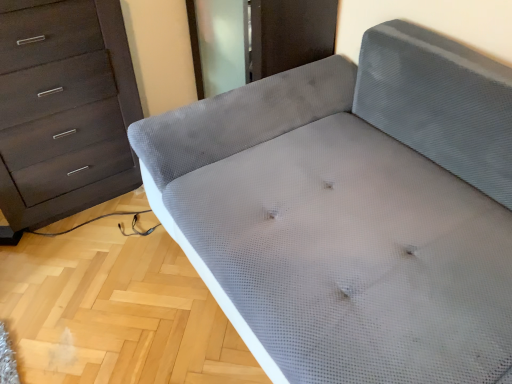
You are a GUI agent. You are given a task and a screenshot of the screen. Output one action in this format:
    pyautogui.click(x=<x>, y=<y>)
    Task: Click on the matte dark brown chest of drawers at left
    The image size is (512, 384).
    Given the screenshot: What is the action you would take?
    pyautogui.click(x=63, y=110)

The image size is (512, 384). What do you see at coordinates (63, 110) in the screenshot? I see `matte dark brown chest of drawers at left` at bounding box center [63, 110].

Measure the distance between point (109, 114) and camera.

5.44 feet.

Find the location of a particular element. The image size is (512, 384). gray fabric couch at center is located at coordinates (352, 211).

The image size is (512, 384). What do you see at coordinates (352, 211) in the screenshot? I see `gray fabric couch at center` at bounding box center [352, 211].

I want to click on matte dark brown chest of drawers at left, so click(x=63, y=110).

Is matte dark brown chest of drawers at left at the right side of gray fabric couch at center?

No.

Consider the image. Between matte dark brown chest of drawers at left and gray fabric couch at center, which one is positioned behind?

matte dark brown chest of drawers at left.

Does point (88, 13) appear closer or farther from the camera than point (408, 120)?

Point (88, 13) is closer to the camera than point (408, 120).

Based on the photo, from the image's perspective, relative to gray fabric couch at center, is matte dark brown chest of drawers at left above or below?

matte dark brown chest of drawers at left is above gray fabric couch at center.

From a real-world perspective, is matte dark brown chest of drawers at left under gray fabric couch at center?

No.

Is matte dark brown chest of drawers at left thinner than gray fabric couch at center?

Indeed, matte dark brown chest of drawers at left has a lesser width compared to gray fabric couch at center.

Can you confirm if matte dark brown chest of drawers at left is taller than gray fabric couch at center?

Indeed, matte dark brown chest of drawers at left has a greater height compared to gray fabric couch at center.

Based on their sizes in the image, would you say matte dark brown chest of drawers at left is bigger or smaller than gray fabric couch at center?

Considering their sizes, matte dark brown chest of drawers at left takes up less space than gray fabric couch at center.

Is matte dark brown chest of drawers at left inside or outside of gray fabric couch at center?

matte dark brown chest of drawers at left is not inside gray fabric couch at center, it's outside.

Is matte dark brown chest of drawers at left in contact with gray fabric couch at center?

There is a gap between matte dark brown chest of drawers at left and gray fabric couch at center.

Could you tell me if matte dark brown chest of drawers at left is facing gray fabric couch at center?

No, matte dark brown chest of drawers at left is not turned towards gray fabric couch at center.

How different are the orientations of matte dark brown chest of drawers at left and gray fabric couch at center in degrees?

90.8 degrees separate the facing orientations of matte dark brown chest of drawers at left and gray fabric couch at center.

The width and height of the screenshot is (512, 384). What are the coordinates of `the chest of drawers located above the gray fabric couch at center (from the image's perspective)` in the screenshot? It's located at (63, 110).

Based on the photo, considering the relative positions of gray fabric couch at center and matte dark brown chest of drawers at left in the image provided, is gray fabric couch at center to the right of matte dark brown chest of drawers at left from the viewer's perspective?

Yes, gray fabric couch at center is to the right of matte dark brown chest of drawers at left.

Considering the relative positions of gray fabric couch at center and matte dark brown chest of drawers at left in the image provided, is gray fabric couch at center in front of matte dark brown chest of drawers at left?

Yes, it is.

Considering the positions of point (211, 205) and point (97, 163), is point (211, 205) closer or farther from the camera than point (97, 163)?

Clearly, point (211, 205) is closer to the camera than point (97, 163).

From the image's perspective, does gray fabric couch at center appear lower than matte dark brown chest of drawers at left?

Indeed, from the image's perspective, gray fabric couch at center is shown beneath matte dark brown chest of drawers at left.

From a real-world perspective, who is located higher, gray fabric couch at center or matte dark brown chest of drawers at left?

matte dark brown chest of drawers at left.

Considering the relative sizes of gray fabric couch at center and matte dark brown chest of drawers at left in the image provided, is gray fabric couch at center wider than matte dark brown chest of drawers at left?

Yes.

Is gray fabric couch at center taller than matte dark brown chest of drawers at left?

In fact, gray fabric couch at center may be shorter than matte dark brown chest of drawers at left.

Considering the sizes of objects gray fabric couch at center and matte dark brown chest of drawers at left in the image provided, who is smaller, gray fabric couch at center or matte dark brown chest of drawers at left?

With smaller size is matte dark brown chest of drawers at left.

Is matte dark brown chest of drawers at left inside gray fabric couch at center?

No, matte dark brown chest of drawers at left is not surrounded by gray fabric couch at center.

Is gray fabric couch at center positioned far away from matte dark brown chest of drawers at left?

They are positioned close to each other.

Is gray fabric couch at center looking in the opposite direction of matte dark brown chest of drawers at left?

No, matte dark brown chest of drawers at left is not at the back of gray fabric couch at center.

In the scene shown: What's the angular difference between gray fabric couch at center and matte dark brown chest of drawers at left's facing directions?

gray fabric couch at center and matte dark brown chest of drawers at left are facing 90.8 degrees away from each other.

How far apart are gray fabric couch at center and matte dark brown chest of drawers at left?

gray fabric couch at center and matte dark brown chest of drawers at left are 27.59 inches apart from each other.

Where is `chest of drawers on the left of gray fabric couch at center`? chest of drawers on the left of gray fabric couch at center is located at coordinates (63, 110).

Image resolution: width=512 pixels, height=384 pixels. Find the location of `furniture below the matte dark brown chest of drawers at left (from the image's perspective)`. furniture below the matte dark brown chest of drawers at left (from the image's perspective) is located at coordinates (352, 211).

Identify the location of furniture on the right of matte dark brown chest of drawers at left. The image size is (512, 384). (352, 211).